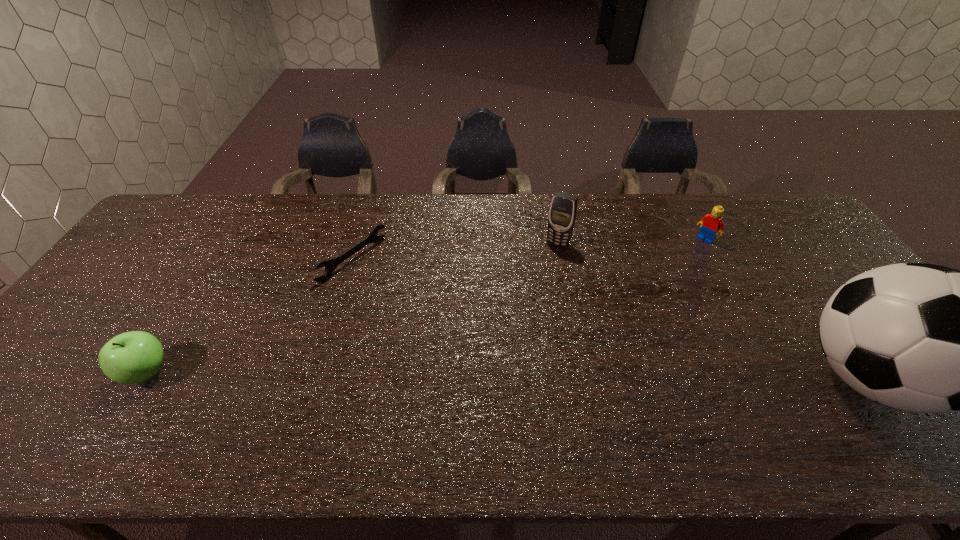
You are a GUI agent. You are given a task and a screenshot of the screen. Output one action in this format:
    pyautogui.click(x=<x>, y=<y>)
    Task: Click on the leftmost object
    This screenshot has width=960, height=540.
    Given the screenshot: What is the action you would take?
    (x=134, y=357)

This screenshot has width=960, height=540. I want to click on Lego, so click(x=710, y=224).

The width and height of the screenshot is (960, 540). Identify the location of cellular telephone. (562, 214).

Identify the location of the third object from left to right. (562, 214).

Find the location of `wrench`. wrench is located at coordinates (330, 265).

You are a GUI agent. You are given a task and a screenshot of the screen. Output one action in this format:
    pyautogui.click(x=<x>, y=<y>)
    Task: Click on the shortest object
    This screenshot has height=540, width=960.
    Given the screenshot: What is the action you would take?
    pyautogui.click(x=330, y=265)

This screenshot has height=540, width=960. Identify the location of free space located on the left of the apple. (57, 373).

Identify the location of vacant region located on the face of the Lego. (665, 278).

Where is `free space located 0.180m on the face of the Lego`? free space located 0.180m on the face of the Lego is located at coordinates (672, 271).

The image size is (960, 540). I want to click on free spot located 0.340m on the face of the Lego, so click(643, 299).